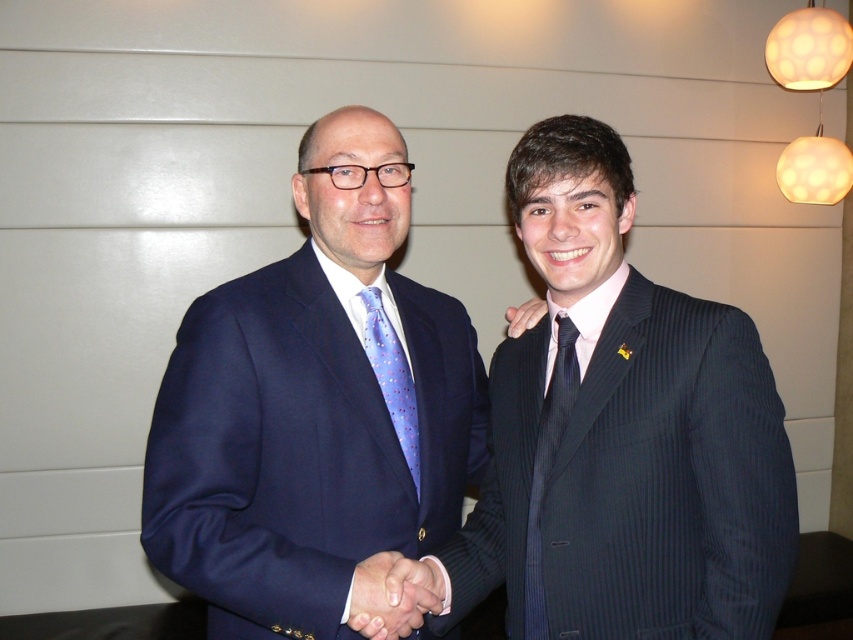
You are an interior designer assessing the space between two objects in the scene. The objects are the dark blue pinstripe suit at center and the smooth leather hand at center. Based on their sizes, which object would require more horizontal space if placed on a shelf?

The dark blue pinstripe suit at center requires more horizontal space because its width is larger than the smooth leather hand at center.

You are a photographer setting up for a formal event. You need to ensure that the subjects in the scene are positioned correctly for a professional photo. Given that the recommended minimum distance between two subjects in a photo is 14 inches to avoid overcrowding, will the current positioning of the matte blue suit at center and the matte black hand at center meet this requirement?

The distance between the matte blue suit at center and the matte black hand at center is 13.95 inches, which is slightly less than the recommended 14 inches. Therefore, the current positioning does not meet the requirement and may result in overcrowding in the photo.